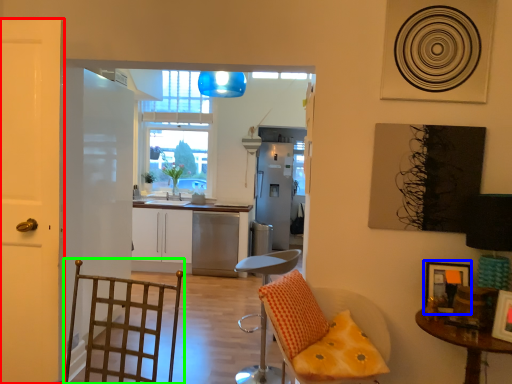
Question: Estimate the real-world distances between objects in this image. Which object is farther from door (highlighted by a red box), picture frame (highlighted by a blue box) or swivel chair (highlighted by a green box)?

Choices:
 (A) picture frame
 (B) swivel chair

Answer: (A)